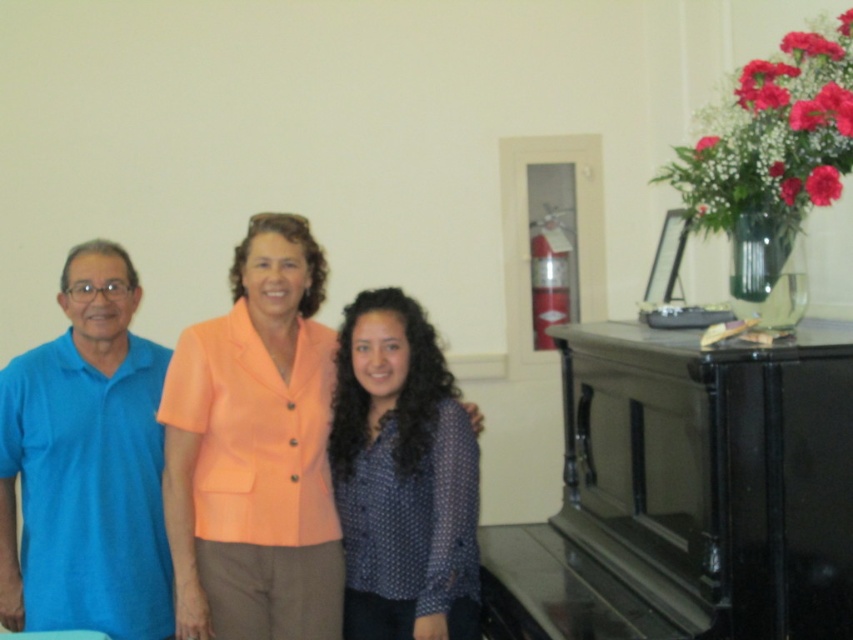
Is blue dotted shirt at center wider than blue cotton shirt at left?

Incorrect, blue dotted shirt at center's width does not surpass blue cotton shirt at left's.

Can you confirm if blue dotted shirt at center is smaller than blue cotton shirt at left?

Yes.

Between point (338, 449) and point (221, 502), which one is positioned in front?

Point (221, 502) is more forward.

I want to click on blue dotted shirt at center, so click(x=401, y=476).

Is orange fabric jacket at center bigger than blue cotton shirt at left?

Yes.

Is orange fabric jacket at center shorter than blue cotton shirt at left?

Yes.

Image resolution: width=853 pixels, height=640 pixels. Find the location of `orange fabric jacket at center`. orange fabric jacket at center is located at coordinates (254, 451).

Identify the location of orange fabric jacket at center. (254, 451).

Which is in front, point (833, 500) or point (32, 468)?

Point (833, 500)

Which is behind, point (782, 499) or point (1, 595)?

The point (1, 595) is more distant.

Is point (764, 588) positioned after point (0, 552)?

No, it is not.

Image resolution: width=853 pixels, height=640 pixels. In order to click on black polished piano at right in this screenshot , I will do `click(688, 493)`.